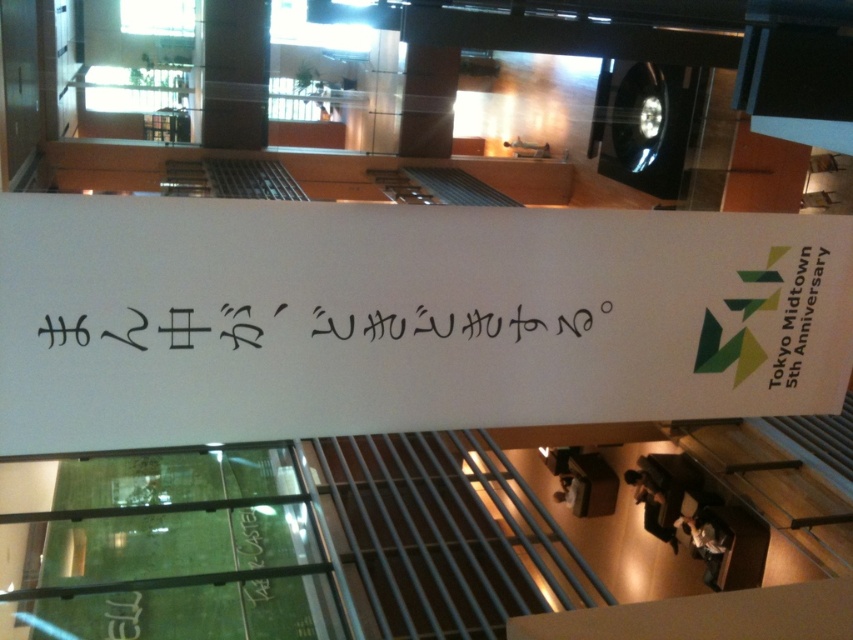
Question: Does black calligraphy at center appear over white paper at upper right?

Choices:
 (A) no
 (B) yes

Answer: (A)

Question: Which point is farther from the camera taking this photo?

Choices:
 (A) (405, 336)
 (B) (167, 205)

Answer: (A)

Question: Is white paper sign at center bigger than black calligraphy at center?

Choices:
 (A) yes
 (B) no

Answer: (A)

Question: Which object is positioned farthest from the white paper sign at center?

Choices:
 (A) white paper at upper right
 (B) black calligraphy at center

Answer: (A)

Question: From the image, what is the correct spatial relationship of black calligraphy at center in relation to white paper at upper right?

Choices:
 (A) right
 (B) left

Answer: (B)

Question: Estimate the real-world distances between objects in this image. Which object is farther from the black calligraphy at center?

Choices:
 (A) white paper sign at center
 (B) white paper at upper right

Answer: (B)